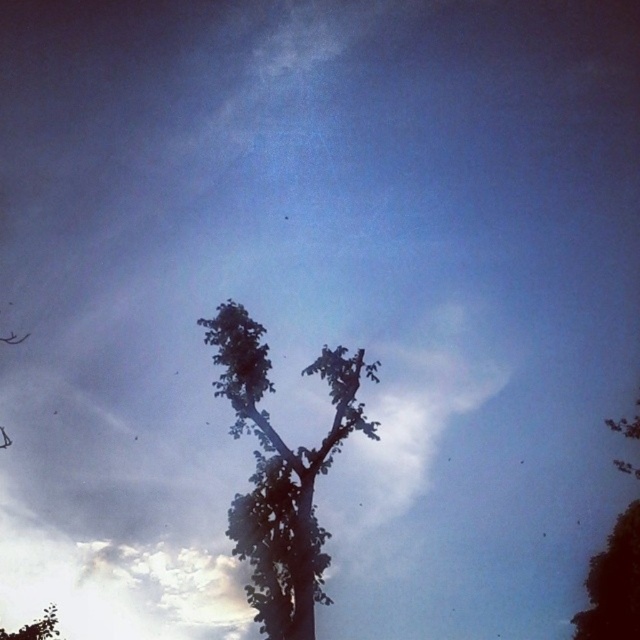
Is dark green leafy tree at center to the left of green leafy tree at lower left from the viewer's perspective?

Incorrect, dark green leafy tree at center is not on the left side of green leafy tree at lower left.

This screenshot has width=640, height=640. Identify the location of dark green leafy tree at center. (282, 472).

Is point (328, 440) less distant than point (49, 616)?

Yes.

Identify the location of dark green leafy tree at center. [x=282, y=472].

Does silhouette leafy tree at upper right have a greater width compared to green leafy tree at lower left?

Yes.

Looking at this image, measure the distance from silhouette leafy tree at upper right to green leafy tree at lower left.

82.98 feet

Measure the distance between point (x=616, y=570) and camera.

Point (x=616, y=570) and camera are 101.60 feet apart.

Where is `silhouette leafy tree at upper right`? Image resolution: width=640 pixels, height=640 pixels. silhouette leafy tree at upper right is located at coordinates (612, 582).

Can you confirm if dark green leafy tree at center is smaller than silhouette leafy tree at upper right?

Actually, dark green leafy tree at center might be larger than silhouette leafy tree at upper right.

Who is more forward, (259, 604) or (588, 627)?

Point (259, 604) is in front.

Is point (256, 614) less distant than point (612, 604)?

Yes.

The height and width of the screenshot is (640, 640). What are the coordinates of `dark green leafy tree at center` in the screenshot? It's located at (282, 472).